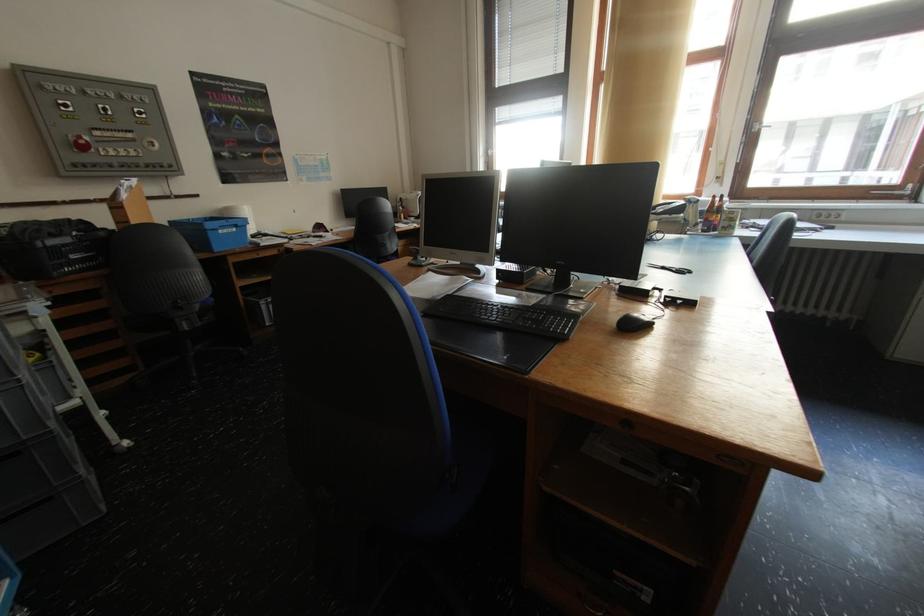
What do you see at coordinates (80, 143) in the screenshot? This screenshot has width=924, height=616. I see `a red control dial` at bounding box center [80, 143].